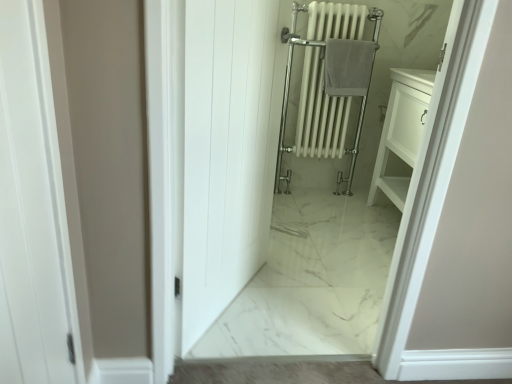
At what (x,y) coordinates should I click in order to perform the action: click on white wood door at center. Please return your answer as a coordinate pair (x, y). The image size is (512, 384). Looking at the image, I should click on (224, 153).

The image size is (512, 384). What do you see at coordinates (348, 67) in the screenshot?
I see `gray cotton towel at center` at bounding box center [348, 67].

At what (x,y) coordinates should I click in order to perform the action: click on white wood door at center. Please return your answer as a coordinate pair (x, y). The image size is (512, 384). Looking at the image, I should click on (224, 153).

Does point (352, 49) appear closer or farther from the camera than point (261, 11)?

Point (352, 49) appears to be farther away from the viewer than point (261, 11).

Considering the relative positions of gray cotton towel at center and white wood door at center in the image provided, is gray cotton towel at center to the left or to the right of white wood door at center?

In the image, gray cotton towel at center appears on the right side of white wood door at center.

Identify the location of door in front of the gray cotton towel at center. This screenshot has height=384, width=512. (224, 153).

Is gray cotton towel at center closer to the viewer compared to white wood door at center?

No, gray cotton towel at center is further to the viewer.

Considering the sizes of objects gray cotton towel at center and white glossy radiator at center in the image provided, who is smaller, gray cotton towel at center or white glossy radiator at center?

Smaller between the two is gray cotton towel at center.

From the image's perspective, which is above, gray cotton towel at center or white glossy radiator at center?

gray cotton towel at center.

Can you confirm if gray cotton towel at center is taller than white glossy radiator at center?

Incorrect, the height of gray cotton towel at center is not larger of that of white glossy radiator at center.

Find the location of a particular element. The width and height of the screenshot is (512, 384). bath towel that appears behind the white glossy radiator at center is located at coordinates (348, 67).

Looking at this image, considering the positions of objects white wood door at center and white glossy radiator at center in the image provided, who is more to the left, white wood door at center or white glossy radiator at center?

From the viewer's perspective, white wood door at center appears more on the left side.

Can you confirm if white wood door at center is wider than white glossy radiator at center?

No.

Is white wood door at center with white glossy radiator at center?

No, white wood door at center is not beside white glossy radiator at center.

Find the location of a particular element. Image resolution: width=512 pixels, height=384 pixels. radiator located behind the white wood door at center is located at coordinates (319, 113).

Is white wood door at center next to gray cotton towel at center and touching it?

No, white wood door at center is not beside gray cotton towel at center.

Which is more to the left, white wood door at center or gray cotton towel at center?

white wood door at center.

Is white wood door at center oriented towards gray cotton towel at center?

No, white wood door at center is not turned towards gray cotton towel at center.

From the image's perspective, between white glossy radiator at center and gray cotton towel at center, which one is located above?

gray cotton towel at center.

Is white glossy radiator at center positioned with its back to gray cotton towel at center?

Yes, gray cotton towel at center is at the back of white glossy radiator at center.

Considering the sizes of white glossy radiator at center and gray cotton towel at center in the image, is white glossy radiator at center bigger or smaller than gray cotton towel at center?

white glossy radiator at center is bigger than gray cotton towel at center.

Considering the sizes of white glossy radiator at center and white wood door at center in the image, is white glossy radiator at center taller or shorter than white wood door at center?

white glossy radiator at center is taller than white wood door at center.

Looking at the image, does white glossy radiator at center seem bigger or smaller compared to white wood door at center?

Clearly, white glossy radiator at center is larger in size than white wood door at center.

Between white glossy radiator at center and white wood door at center, which one has larger width?

white glossy radiator at center is wider.

Image resolution: width=512 pixels, height=384 pixels. I want to click on bath towel on the right of white wood door at center, so click(x=348, y=67).

Identify the location of radiator in front of the gray cotton towel at center. (319, 113).

When comparing their distances from white glossy radiator at center, does white wood door at center or gray cotton towel at center seem closer?

gray cotton towel at center.

Based on their spatial positions, is white glossy radiator at center or white wood door at center closer to gray cotton towel at center?

white glossy radiator at center lies closer to gray cotton towel at center than the other object.

Looking at the image, which one is located closer to gray cotton towel at center, white wood door at center or white glossy radiator at center?

white glossy radiator at center is closer to gray cotton towel at center.

Estimate the real-world distances between objects in this image. Which object is further from white glossy radiator at center, gray cotton towel at center or white wood door at center?

white wood door at center is further to white glossy radiator at center.

Looking at the image, which one is located closer to white wood door at center, white glossy radiator at center or gray cotton towel at center?

gray cotton towel at center.

Based on their spatial positions, is gray cotton towel at center or white glossy radiator at center closer to white wood door at center?

Based on the image, gray cotton towel at center appears to be nearer to white wood door at center.

I want to click on radiator located between white wood door at center and gray cotton towel at center in the depth direction, so click(x=319, y=113).